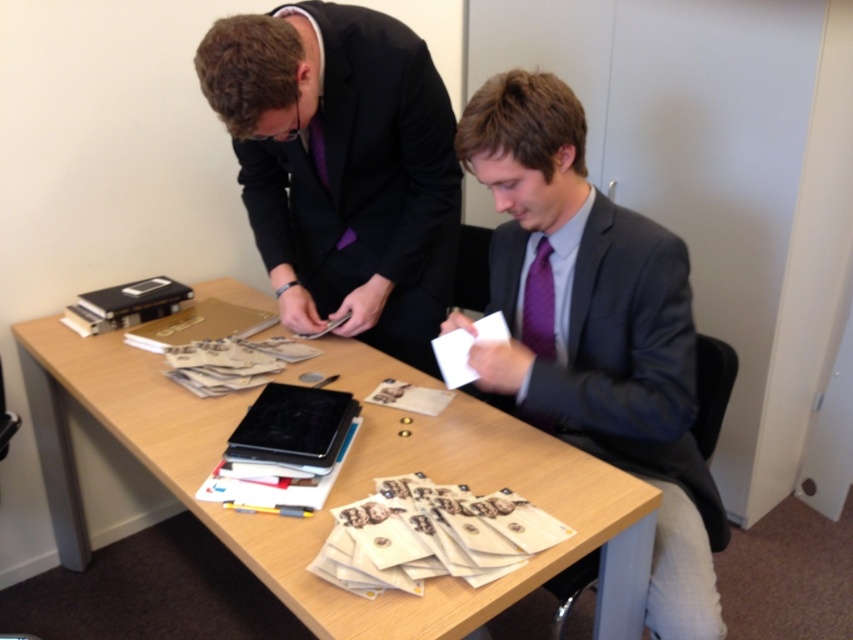
Who is shorter, matte black suit at center or purple satin tie at center?

purple satin tie at center

Does point (459, 182) come closer to viewer compared to point (543, 266)?

No, it is behind (543, 266).

The image size is (853, 640). What do you see at coordinates (343, 163) in the screenshot?
I see `matte black suit at center` at bounding box center [343, 163].

Where is `matte black suit at center`? This screenshot has width=853, height=640. matte black suit at center is located at coordinates (343, 163).

Does point (519, 113) lie behind point (434, 342)?

No, it is not.

Between point (521, 129) and point (437, 340), which one is positioned in front?

Point (521, 129)

Is point (554, 234) behind point (451, 356)?

No, it is in front of (451, 356).

The height and width of the screenshot is (640, 853). Find the location of `matte gray suit at center`. matte gray suit at center is located at coordinates (596, 330).

Can you confirm if matte black suit at center is positioned below white paper at lower center?

No, matte black suit at center is not below white paper at lower center.

Who is more forward, (393, 74) or (469, 342)?

Point (469, 342) is in front.

I want to click on matte black suit at center, so click(343, 163).